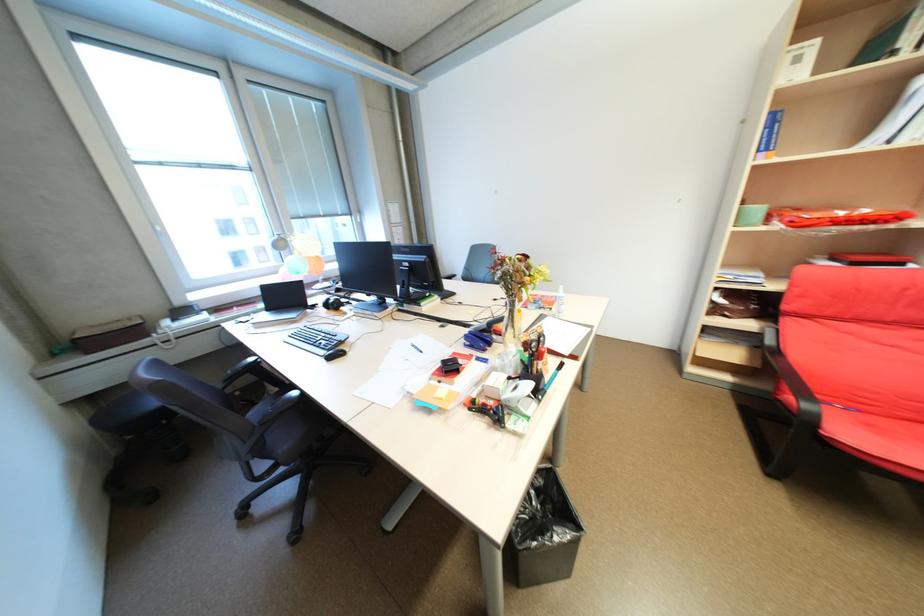
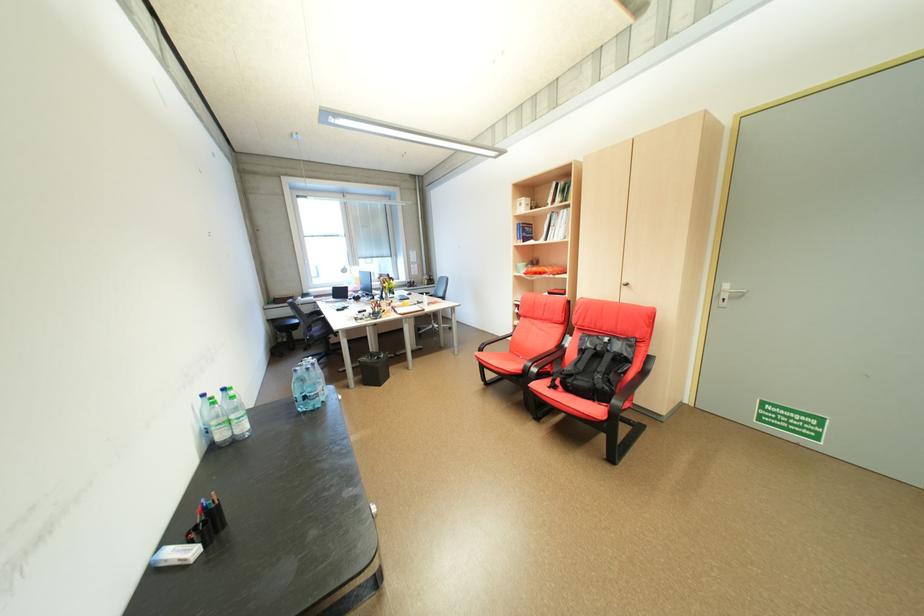
From the picture: In a continuous first-person perspective shot, in which direction is the camera moving?

The cameraman walked toward right, backward.